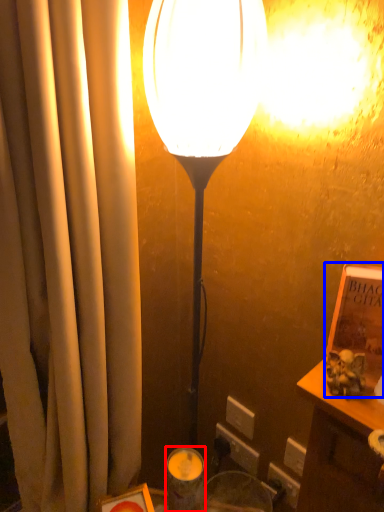
Question: Which object is closer to the camera taking this photo, candle holder (highlighted by a red box) or book (highlighted by a blue box)?

Choices:
 (A) candle holder
 (B) book

Answer: (B)